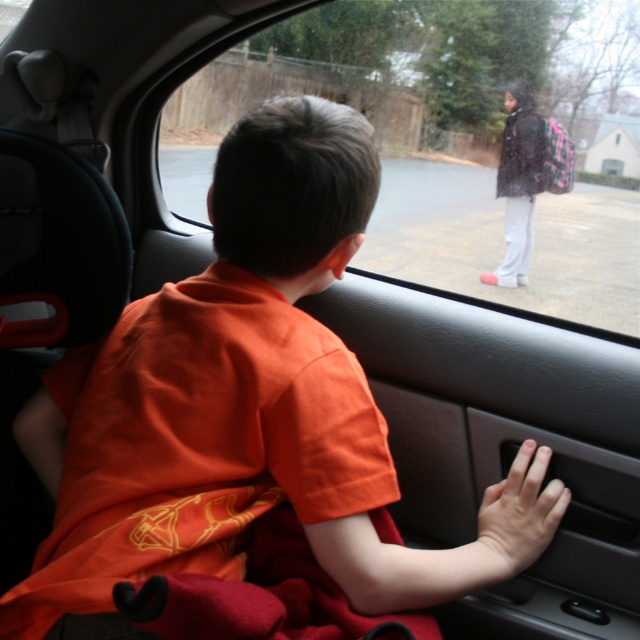
Question: Can you confirm if smooth skin hand at lower right is bigger than dark matte jacket at upper right?

Choices:
 (A) yes
 (B) no

Answer: (B)

Question: Among these points, which one is nearest to the camera?

Choices:
 (A) (497, 464)
 (B) (509, 257)
 (C) (481, 35)
 (D) (483, 536)

Answer: (D)

Question: Does transparent glass car window at center have a greater width compared to smooth skin hand at lower right?

Choices:
 (A) yes
 (B) no

Answer: (A)

Question: Among these objects, which one is farthest from the camera?

Choices:
 (A) dark matte jacket at upper right
 (B) transparent glass car window at center

Answer: (A)

Question: Which object appears farthest from the camera in this image?

Choices:
 (A) smooth skin hand at lower right
 (B) black matte car door handle at lower right
 (C) dark matte jacket at upper right

Answer: (C)

Question: Is transparent glass car window at center in front of black matte car door handle at lower right?

Choices:
 (A) no
 (B) yes

Answer: (A)